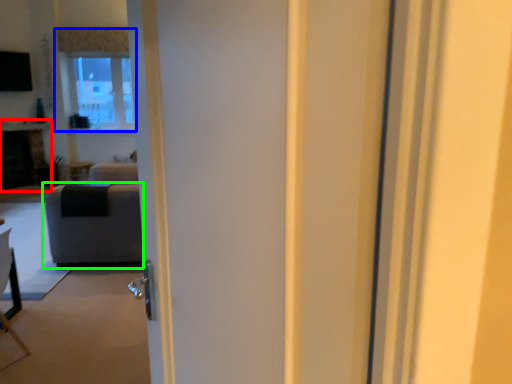
Question: Which is nearer to the fireplace (highlighted by a red box)? window (highlighted by a blue box) or furniture (highlighted by a green box).

Choices:
 (A) window
 (B) furniture

Answer: (A)